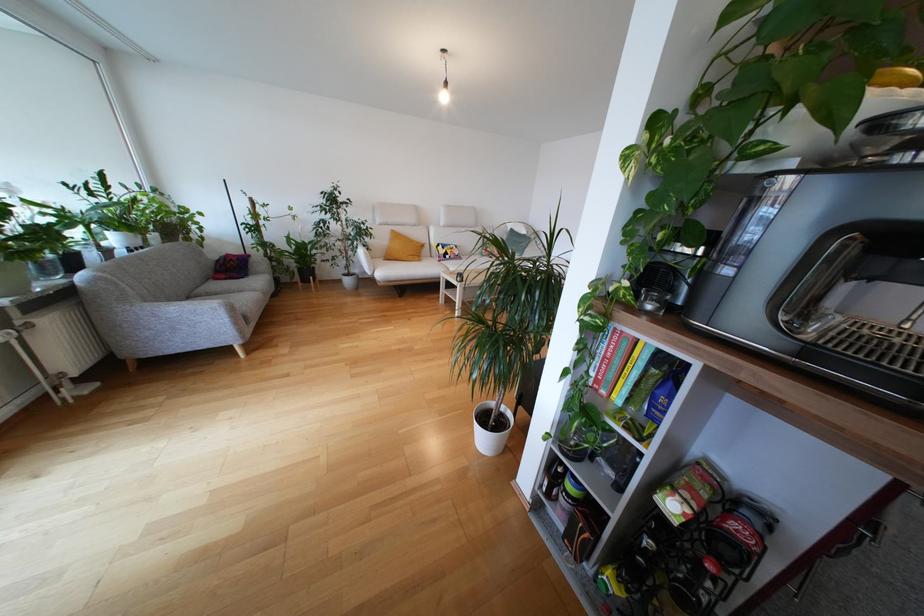
Where would you lift the yellow book? Please return your answer as a coordinate pair (x, y).

(626, 369)